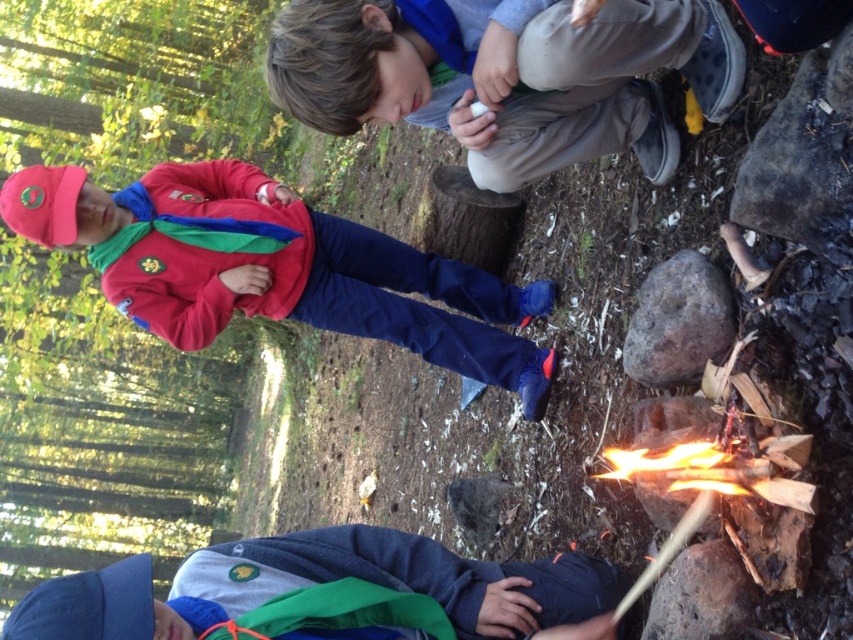
Question: In this image, where is gray cotton pants at upper right located relative to red fleece jacket at left?

Choices:
 (A) below
 (B) above

Answer: (B)

Question: Which object is the closest to the dark blue fleece jacket at lower center?

Choices:
 (A) red fleece jacket at left
 (B) gray cotton pants at upper right

Answer: (B)

Question: In this image, where is green leafy tree at upper left located relative to red fleece jacket at left?

Choices:
 (A) left
 (B) right

Answer: (A)

Question: Is gray cotton pants at upper right positioned behind red fleece jacket at left?

Choices:
 (A) yes
 (B) no

Answer: (B)

Question: Which point is farther to the camera?

Choices:
 (A) (556, 116)
 (B) (62, 396)
 (C) (67, 621)

Answer: (B)

Question: Considering the real-world distances, which object is closest to the green leafy tree at upper left?

Choices:
 (A) dark blue fleece jacket at lower center
 (B) gray cotton pants at upper right
 (C) red fleece jacket at left

Answer: (C)